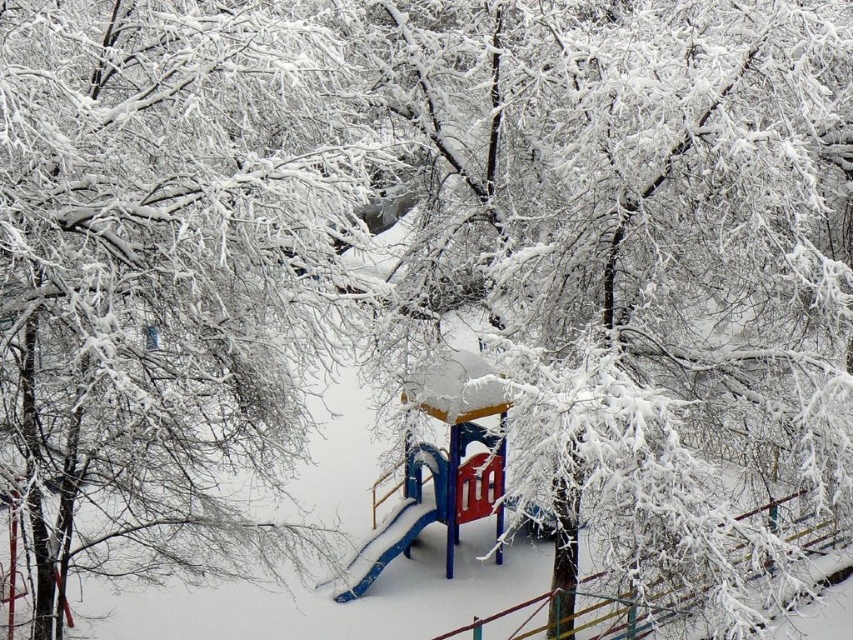
Question: Which point appears farthest from the camera in this image?

Choices:
 (A) (138, 324)
 (B) (398, 509)

Answer: (B)

Question: Can you confirm if snow-covered branches at center is positioned above blue plastic slide at center?

Choices:
 (A) yes
 (B) no

Answer: (A)

Question: Which point is farther from the camera taking this photo?

Choices:
 (A) (397, 524)
 (B) (65, 496)

Answer: (A)

Question: Can you confirm if snow-covered branches at center is positioned above blue plastic slide at center?

Choices:
 (A) no
 (B) yes

Answer: (B)

Question: Is snow-covered branches at center bigger than blue plastic slide at center?

Choices:
 (A) yes
 (B) no

Answer: (B)